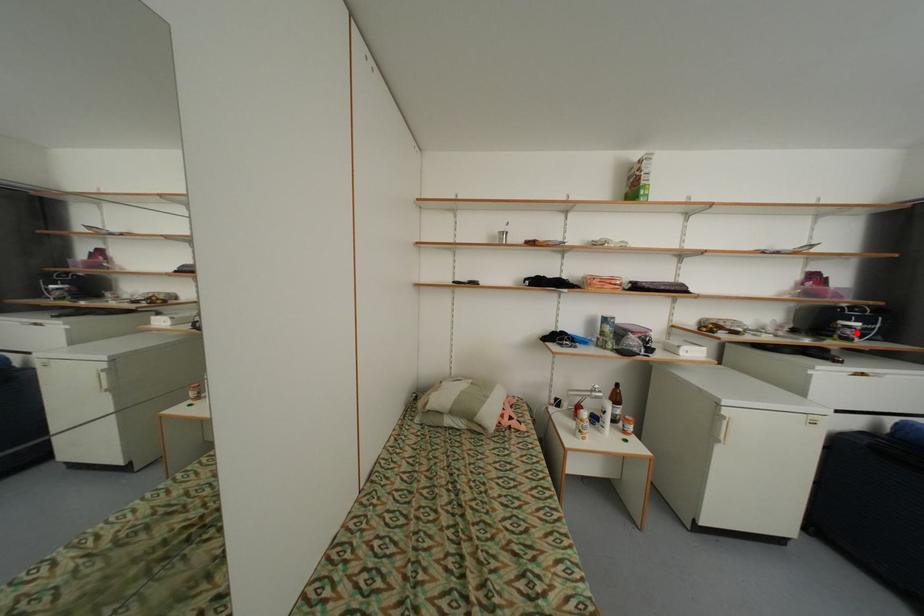
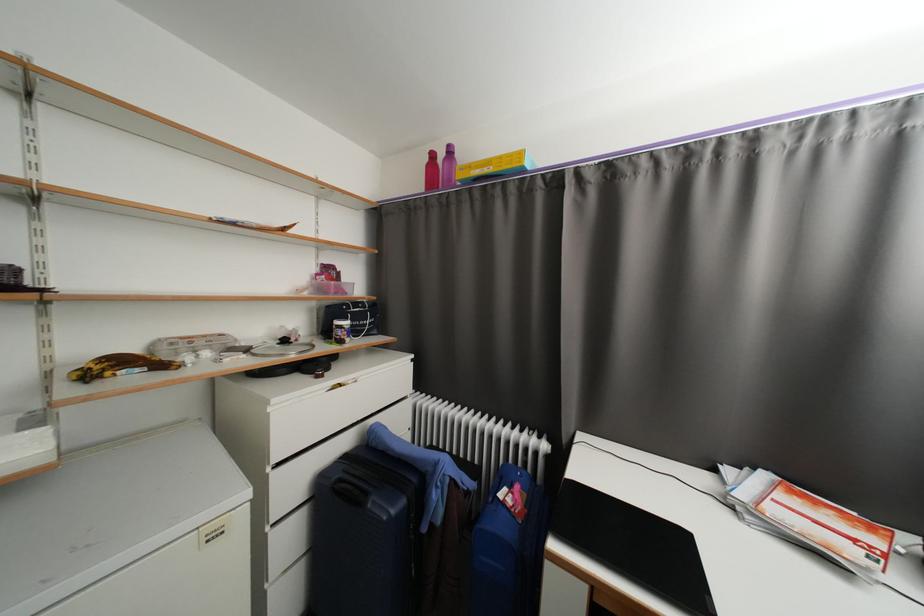
Question: I am providing you with two images of the same scene from different viewpoints. A red point is marked on the first image. Can you still see the location of the red point in image 2?

Choices:
 (A) Yes
 (B) No

Answer: (A)